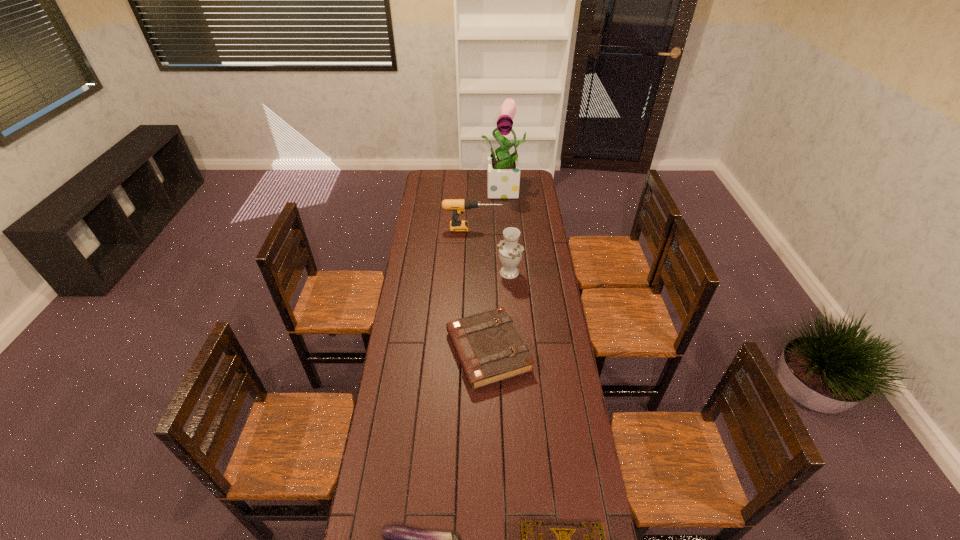
This screenshot has width=960, height=540. Identify the location of vacant area that lies between the flower arrangement and the fifth nearest object. (490, 210).

Identify which object is the nearest to the third farthest object. Please provide its 2D coordinates. Your answer should be formatted as a tuple, i.e. [(x, y)], where the tuple contains the x and y coordinates of a point satisfying the conditions above.

[(488, 346)]

Point out which object is positioned as the fifth nearest to the nearer hardback book. Please provide its 2D coordinates. Your answer should be formatted as a tuple, i.e. [(x, y)], where the tuple contains the x and y coordinates of a point satisfying the conditions above.

[(503, 174)]

Where is `vacant area in the image that satisfies the following two spatial constraints: 1. on the handle side of the second farthest object; 2. on the right side of the taller hardback book`? The height and width of the screenshot is (540, 960). vacant area in the image that satisfies the following two spatial constraints: 1. on the handle side of the second farthest object; 2. on the right side of the taller hardback book is located at coordinates (469, 351).

Find the location of a particular element. free space that satisfies the following two spatial constraints: 1. on the handle side of the third shortest object; 2. on the left side of the fifth nearest object is located at coordinates (469, 351).

Locate an element on the screen. The image size is (960, 540). free location that satisfies the following two spatial constraints: 1. on the handle side of the fifth nearest object; 2. on the right side of the fourth tallest object is located at coordinates (469, 351).

You are a GUI agent. You are given a task and a screenshot of the screen. Output one action in this format:
    pyautogui.click(x=<x>, y=<y>)
    Task: Click on the free space that satisfies the following two spatial constraints: 1. on the handle side of the third tallest object; 2. on the right side of the vase
    
    Given the screenshot: What is the action you would take?
    pyautogui.click(x=471, y=273)

I want to click on free point that satisfies the following two spatial constraints: 1. on the front-facing side of the farthest object; 2. on the handle side of the drill, so click(509, 229).